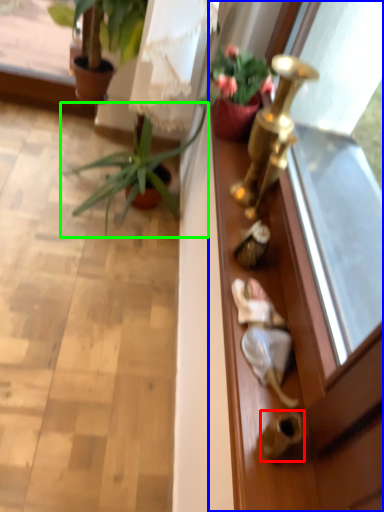
Question: Which object is positioned closest to door handle (highlighted by a red box)? Select from screen door (highlighted by a blue box) and houseplant (highlighted by a green box).

Choices:
 (A) screen door
 (B) houseplant

Answer: (A)